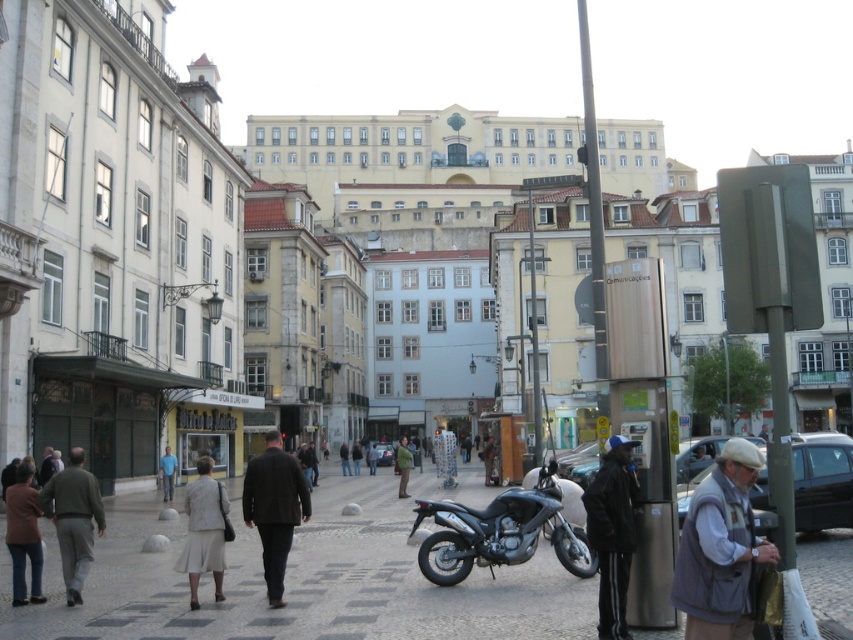
Question: Does paved stone sidewalk at center appear over light beige fabric skirt at lower left?

Choices:
 (A) yes
 (B) no

Answer: (B)

Question: Among these points, which one is farthest from the camera?

Choices:
 (A) (334, 592)
 (B) (192, 561)

Answer: (A)

Question: Among these objects, which one is nearest to the camera?

Choices:
 (A) brown wool coat at lower left
 (B) dark brown leather jacket at center
 (C) paved stone sidewalk at center

Answer: (C)

Question: Can you confirm if light beige fabric skirt at lower left is bigger than matte black jacket at center?

Choices:
 (A) yes
 (B) no

Answer: (A)

Question: Is dark brown leather jacket at center further to the viewer compared to brown wool coat at lower left?

Choices:
 (A) yes
 (B) no

Answer: (A)

Question: Which point is farther from the camera taking this photo?

Choices:
 (A) (469, 536)
 (B) (450, 454)
 (C) (212, 504)

Answer: (B)